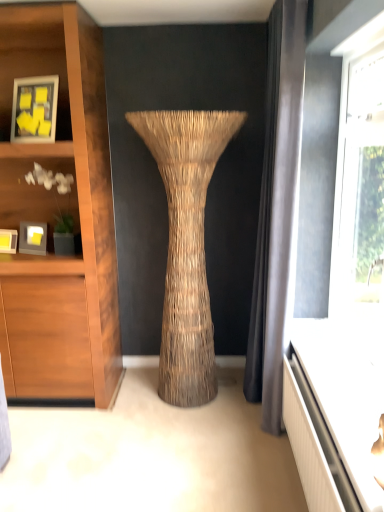
Question: Is matte black picture frame at left, the first picture frame from the bottom, wider than matte wood shelf at left?

Choices:
 (A) no
 (B) yes

Answer: (A)

Question: Does matte black picture frame at left, the first picture frame from the bottom, have a greater height compared to matte wood shelf at left?

Choices:
 (A) yes
 (B) no

Answer: (B)

Question: From the image's perspective, is matte black picture frame at left, positioned as the 3th picture frame in top-to-bottom order, over matte wood shelf at left?

Choices:
 (A) yes
 (B) no

Answer: (B)

Question: From a real-world perspective, is matte black picture frame at left, positioned as the 3th picture frame in top-to-bottom order, positioned under matte wood shelf at left based on gravity?

Choices:
 (A) no
 (B) yes

Answer: (B)

Question: Is matte black picture frame at left, positioned as the 3th picture frame in top-to-bottom order, facing away from matte wood shelf at left?

Choices:
 (A) yes
 (B) no

Answer: (B)

Question: From a real-world perspective, relative to white glossy vanity at lower right, is braided straw vase at center vertically above or below?

Choices:
 (A) above
 (B) below

Answer: (A)

Question: From the image's perspective, is braided straw vase at center positioned above or below white glossy vanity at lower right?

Choices:
 (A) above
 (B) below

Answer: (A)

Question: Choose the correct answer: Is braided straw vase at center inside white glossy vanity at lower right or outside it?

Choices:
 (A) inside
 (B) outside

Answer: (B)

Question: Based on their sizes in the image, would you say braided straw vase at center is bigger or smaller than white glossy vanity at lower right?

Choices:
 (A) small
 (B) big

Answer: (B)

Question: In terms of height, does matte black picture frame at left, the second picture frame from the bottom, look taller or shorter compared to black fabric curtain at right?

Choices:
 (A) tall
 (B) short

Answer: (B)

Question: From a real-world perspective, relative to black fabric curtain at right, is matte black picture frame at left, the second picture frame when ordered from top to bottom, vertically above or below?

Choices:
 (A) above
 (B) below

Answer: (B)

Question: From the image's perspective, is matte black picture frame at left, the second picture frame from the bottom, positioned above or below black fabric curtain at right?

Choices:
 (A) above
 (B) below

Answer: (B)

Question: In terms of width, does matte black picture frame at left, the second picture frame when ordered from top to bottom, look wider or thinner when compared to black fabric curtain at right?

Choices:
 (A) wide
 (B) thin

Answer: (B)

Question: From the image's perspective, is matte black picture frame at left, positioned as the 3th picture frame in top-to-bottom order, located above or below white glossy vanity at lower right?

Choices:
 (A) below
 (B) above

Answer: (B)

Question: Which is correct: matte black picture frame at left, the first picture frame from the bottom, is inside white glossy vanity at lower right, or outside of it?

Choices:
 (A) inside
 (B) outside

Answer: (B)